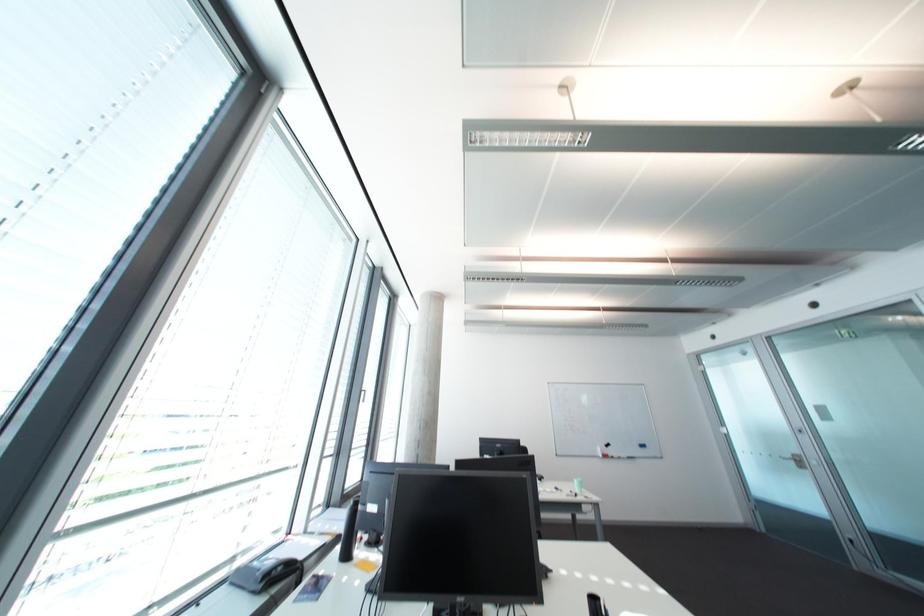
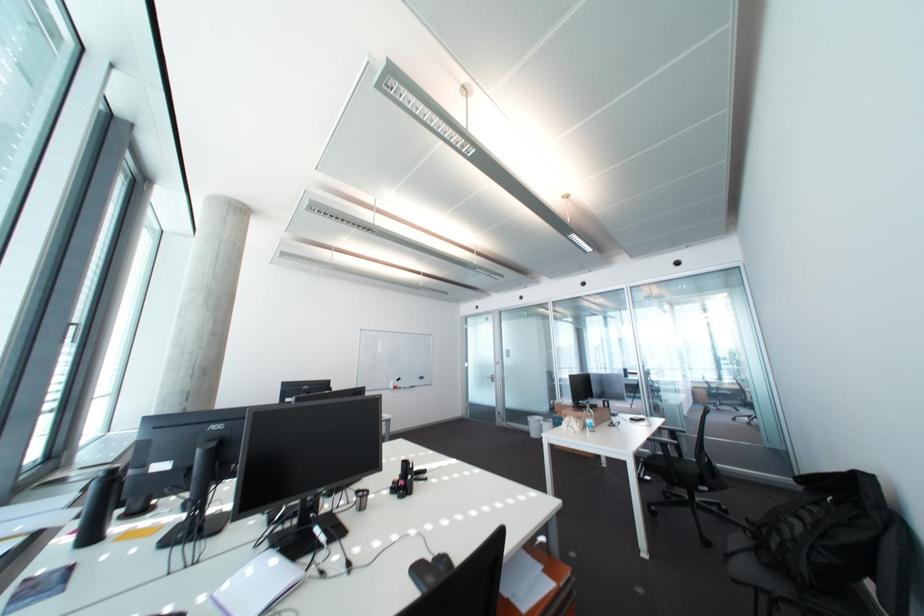
Question: How did the camera likely rotate?

Choices:
 (A) Left
 (B) Right
 (C) Up
 (D) Down

Answer: (B)